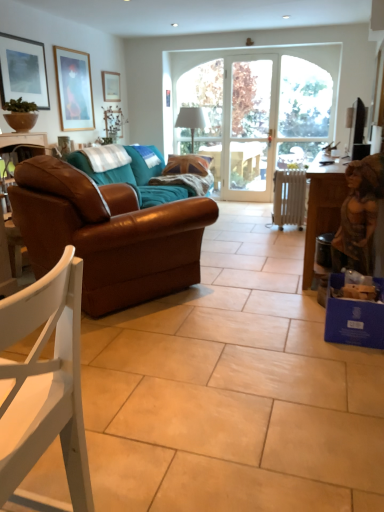
Where is `vacant space positioned to the left of blue cardboard box at lower right`? vacant space positioned to the left of blue cardboard box at lower right is located at coordinates (297, 325).